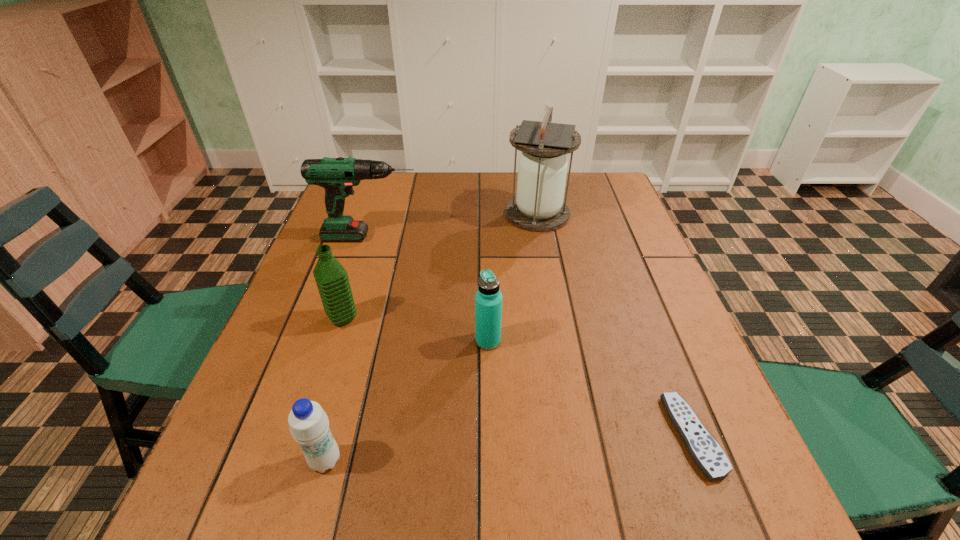
In the image, there is a desktop. Where is `free space at the right edge`? This screenshot has width=960, height=540. free space at the right edge is located at coordinates (604, 278).

In order to click on vacant space at the far right corner of the desktop in this screenshot , I will do `click(620, 211)`.

Where is `vacant region at the near right corner of the desktop`? The width and height of the screenshot is (960, 540). vacant region at the near right corner of the desktop is located at coordinates (693, 502).

Locate an element on the screen. This screenshot has width=960, height=540. free space between the farthest water bottle and the second tallest object is located at coordinates (357, 278).

The image size is (960, 540). What are the coordinates of `free space between the second nearest water bottle and the nearest water bottle` in the screenshot? It's located at (407, 401).

Identify the location of empty space between the tallest object and the fifth shortest object. The height and width of the screenshot is (540, 960). (454, 226).

Where is `free space that is in between the fifth object from left to right and the third object from right to left`? The width and height of the screenshot is (960, 540). free space that is in between the fifth object from left to right and the third object from right to left is located at coordinates (513, 278).

Locate an element on the screen. vacant space in between the third object from right to left and the farthest water bottle is located at coordinates (416, 330).

The image size is (960, 540). Identify the location of free area in between the second tallest object and the remote control. (533, 336).

At what (x,y) coordinates should I click in order to perform the action: click on vacant point located between the fifth object from left to right and the third farthest object. Please return your answer as a coordinate pair (x, y). This screenshot has height=540, width=960. Looking at the image, I should click on (441, 266).